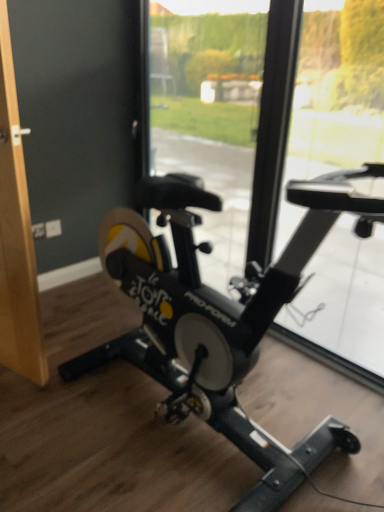
Question: From a real-world perspective, relative to wooden door handle at left, is transparent glass window at center, acting as the 2th window screen starting from the left, vertically above or below?

Choices:
 (A) above
 (B) below

Answer: (A)

Question: Considering their positions, is transparent glass window at center, arranged as the 1th window screen when viewed from the right, located in front of or behind wooden door handle at left?

Choices:
 (A) front
 (B) behind

Answer: (B)

Question: Which is nearer to the black matte stationary bicycle at center?

Choices:
 (A) transparent glass window at center, which appears as the second window screen when viewed from the right
 (B) transparent glass window at center, acting as the 2th window screen starting from the left
 (C) wooden door handle at left

Answer: (C)

Question: Which is farther from the transparent glass window at center, acting as the 2th window screen starting from the left?

Choices:
 (A) black matte stationary bicycle at center
 (B) transparent glass window at center, the 1th window screen positioned from the left
 (C) wooden door handle at left

Answer: (C)